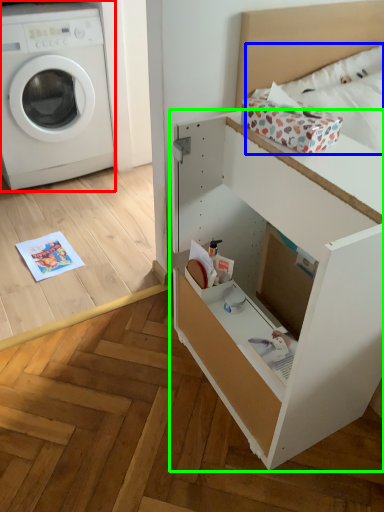
Question: Which object is positioned closest to washing machine (highlighted by a red box)? Select from bedding (highlighted by a blue box) and file cabinet (highlighted by a green box).

Choices:
 (A) bedding
 (B) file cabinet

Answer: (A)